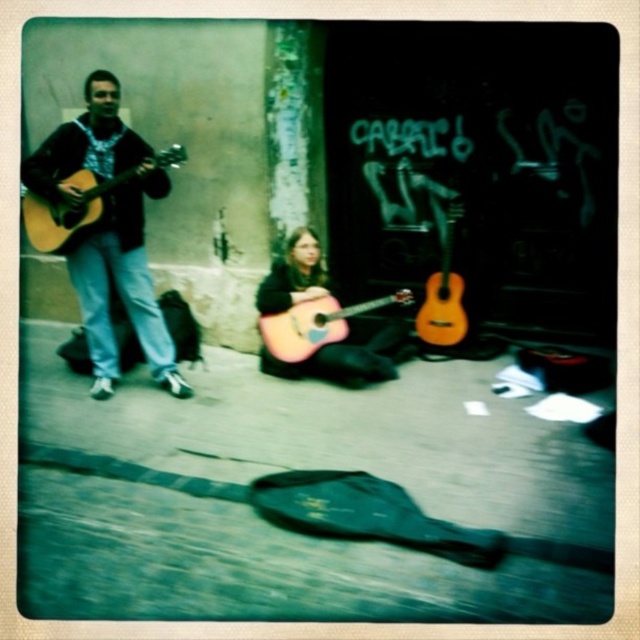
Between matte black guitar at left and matte acoustic guitar at left, which one is positioned higher?

matte acoustic guitar at left

Is matte black guitar at left to the left of matte acoustic guitar at left from the viewer's perspective?

No, matte black guitar at left is not to the left of matte acoustic guitar at left.

I want to click on matte black guitar at left, so point(108,230).

I want to click on matte black guitar at left, so click(x=108, y=230).

Is wooden acoustic guitar at center above orange wood guitar at center?

Incorrect, wooden acoustic guitar at center is not positioned above orange wood guitar at center.

Between wooden acoustic guitar at center and orange wood guitar at center, which one is positioned higher?

orange wood guitar at center is above.

Does point (349, 364) lie in front of point (442, 330)?

Yes, point (349, 364) is in front of point (442, 330).

Find the location of a particular element. The width and height of the screenshot is (640, 640). wooden acoustic guitar at center is located at coordinates (348, 355).

Can you confirm if smooth concrete pavement at center is positioned above wooden acoustic guitar at center?

No, smooth concrete pavement at center is not above wooden acoustic guitar at center.

Can you confirm if smooth concrete pavement at center is positioned to the right of wooden acoustic guitar at center?

In fact, smooth concrete pavement at center is to the left of wooden acoustic guitar at center.

Find the location of a particular element. This screenshot has height=640, width=640. smooth concrete pavement at center is located at coordinates (301, 467).

You are a GUI agent. You are given a task and a screenshot of the screen. Output one action in this format:
    pyautogui.click(x=<x>, y=<y>)
    Task: Click on the smooth concrete pavement at center
    This screenshot has width=640, height=640.
    Given the screenshot: What is the action you would take?
    pyautogui.click(x=301, y=467)